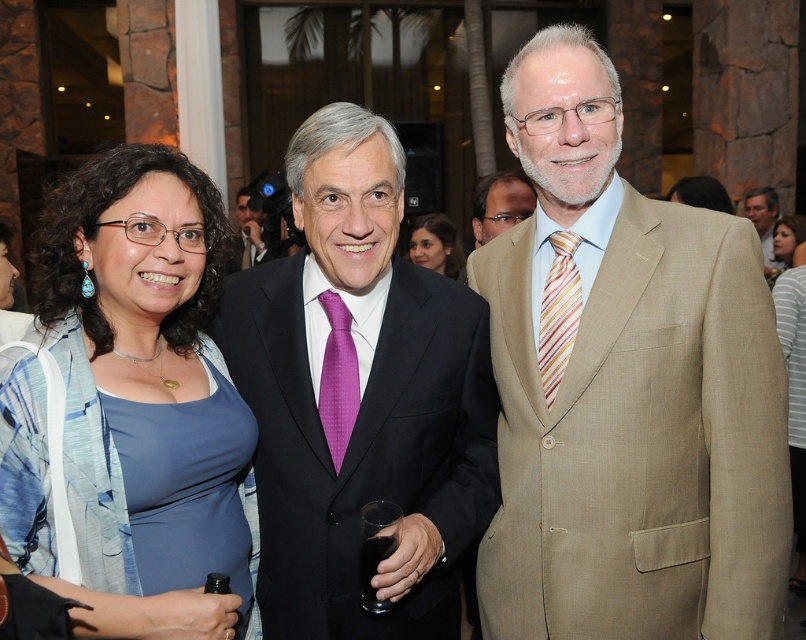
You are standing in the same room as the three people in the image and want to move closer to both point (x=537, y=552) and point (x=779, y=252). Which point will you reach first if you walk straight towards them?

You will reach point (x=537, y=552) first because it is closer to you than point (x=779, y=252).